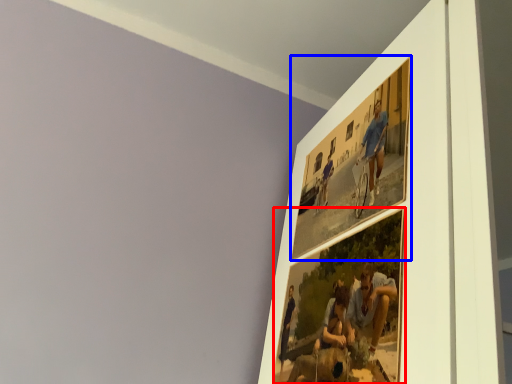
Question: Which object appears farthest to the camera in this image, picture frame (highlighted by a red box) or picture frame (highlighted by a blue box)?

Choices:
 (A) picture frame
 (B) picture frame

Answer: (B)